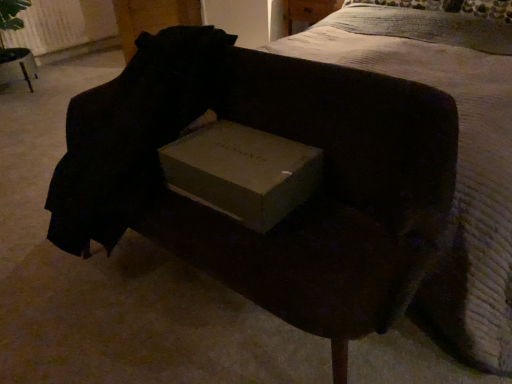
Question: Considering the positions of point (504, 107) and point (91, 235), is point (504, 107) closer or farther from the camera than point (91, 235)?

Choices:
 (A) closer
 (B) farther

Answer: (B)

Question: From their relative heights in the image, would you say white textured bed at upper center is taller or shorter than matte cardboard box at center?

Choices:
 (A) short
 (B) tall

Answer: (B)

Question: Which of these objects is positioned farthest from the white textured bed at upper center?

Choices:
 (A) matte cardboard box at center
 (B) matte cardboard box at center

Answer: (B)

Question: Which is farther from the matte cardboard box at center?

Choices:
 (A) white textured bed at upper center
 (B) matte cardboard box at center

Answer: (A)